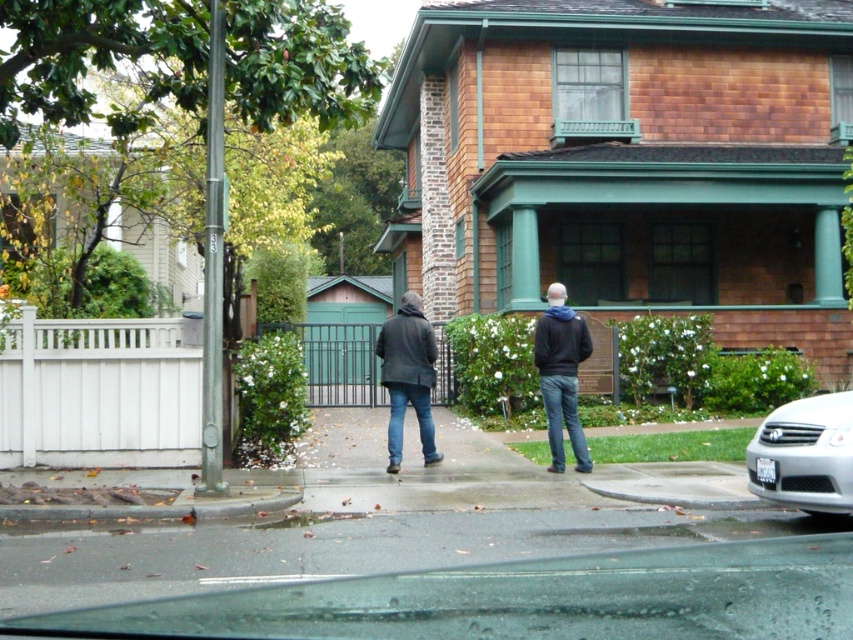
Question: Does smooth asphalt pavement at lower center lie in front of black matte jacket at center?

Choices:
 (A) yes
 (B) no

Answer: (A)

Question: Considering the real-world distances, which object is closest to the black matte jacket at center?

Choices:
 (A) dark gray jacket at center
 (B) smooth asphalt pavement at lower center

Answer: (A)

Question: Can you confirm if dark gray jacket at center is bigger than black matte jacket at center?

Choices:
 (A) yes
 (B) no

Answer: (B)

Question: Which of the following is the farthest from the observer?

Choices:
 (A) black matte jacket at center
 (B) dark gray jacket at center
 (C) smooth asphalt pavement at lower center

Answer: (B)

Question: Is dark gray jacket at center bigger than silver metallic sedan at lower right?

Choices:
 (A) yes
 (B) no

Answer: (B)

Question: Which object is positioned farthest from the smooth asphalt pavement at lower center?

Choices:
 (A) silver metallic sedan at lower right
 (B) dark gray jacket at center
 (C) black matte jacket at center

Answer: (B)